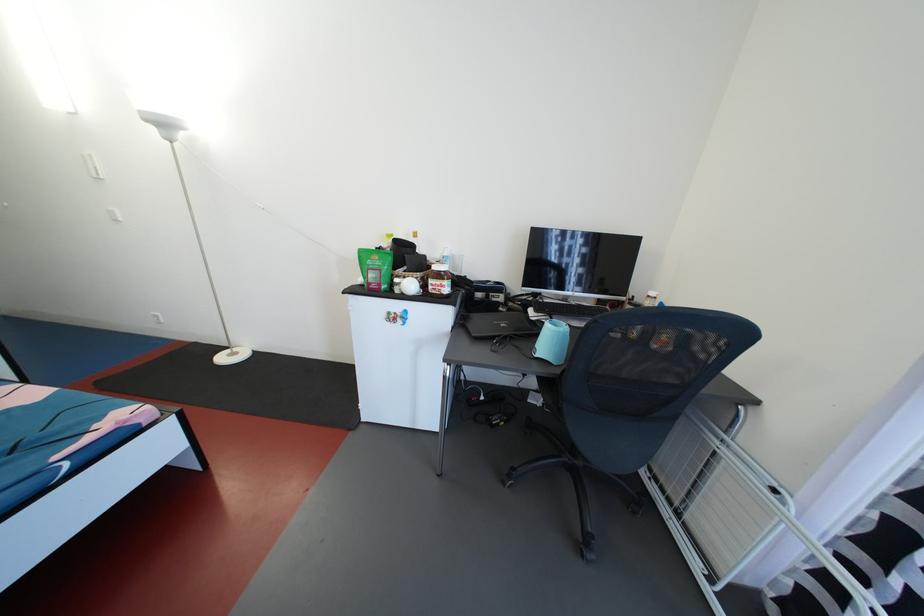
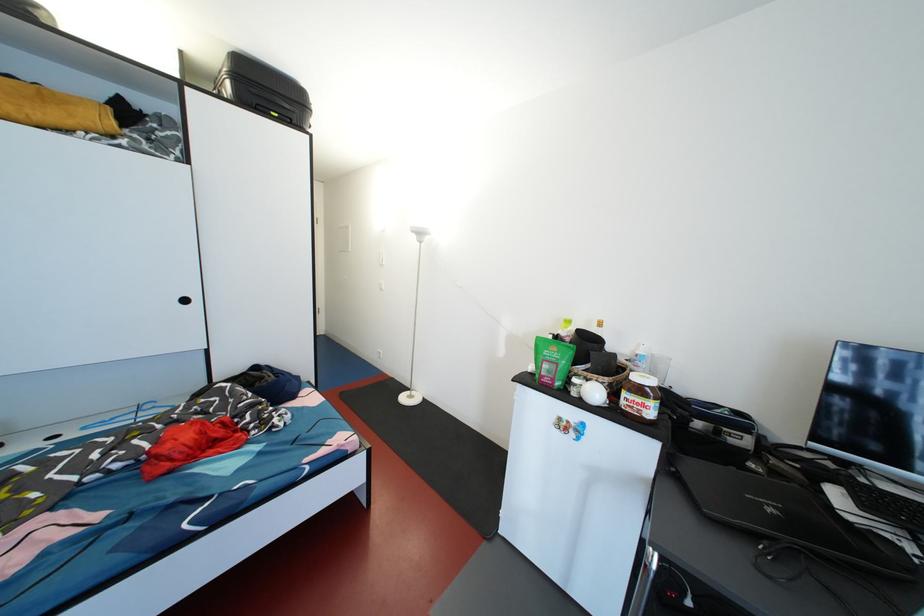
In the second image, find the point that corresponds to (417,290) in the first image.

(601, 397)